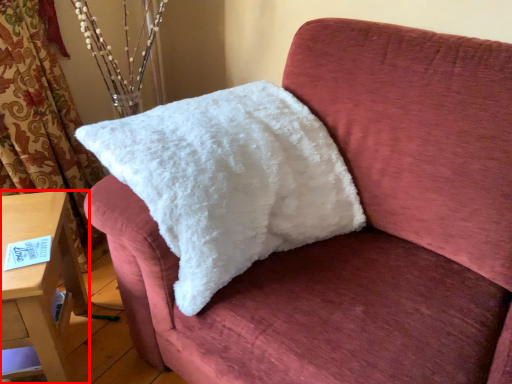
Question: From the image's perspective, where is furniture (annotated by the red box) located in relation to pillow in the image?

Choices:
 (A) above
 (B) below

Answer: (B)